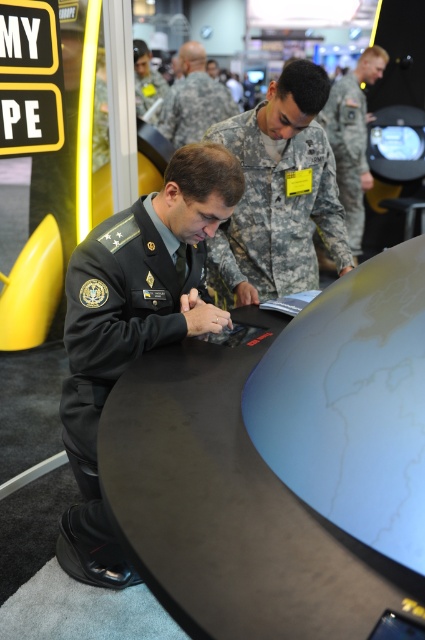
You are a photographer at the event and need to capture a clear photo of both the dark gray uniform at center and the camouflage fabric uniform at center. Since you can only focus on one subject at a time, which uniform should you focus on to ensure the other is still somewhat in focus?

The dark gray uniform at center is in front of the camouflage fabric uniform at center. By focusing on the dark gray uniform at center, the camouflage fabric uniform at center will be slightly out of focus but still somewhat visible.

You are a photographer at the event and need to capture a photo of both the dark gray uniform at center and the camouflage fabric uniform at center in the same frame. The camera you are using has a minimum focus distance of 60 centimeters. Will you be able to take the photo without moving either uniform?

The dark gray uniform at center and camouflage fabric uniform at center are 57.76 centimeters apart. Since the distance between them is less than the camera minimum focus distance of 60 centimeters, you will not be able to capture both in focus in the same frame without moving them closer together.